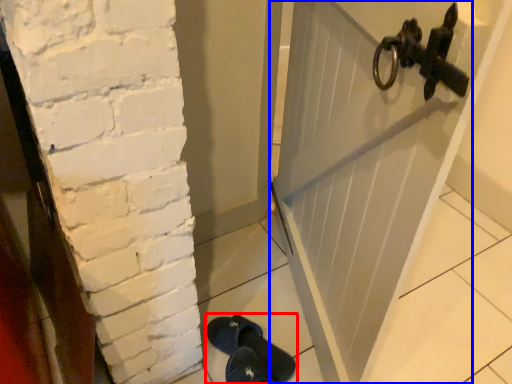
Question: Among these objects, which one is nearest to the camera, footwear (highlighted by a red box) or door (highlighted by a blue box)?

Choices:
 (A) footwear
 (B) door

Answer: (A)